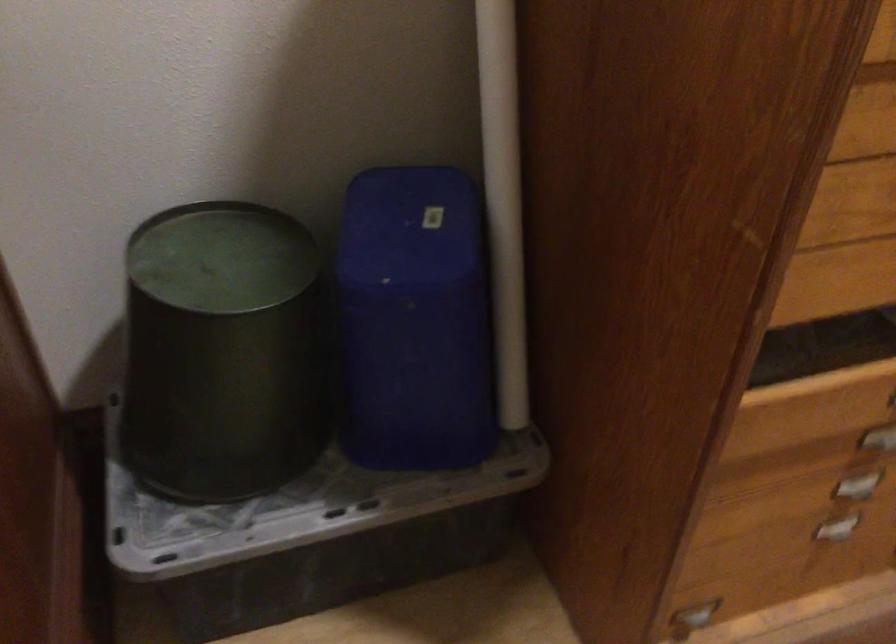
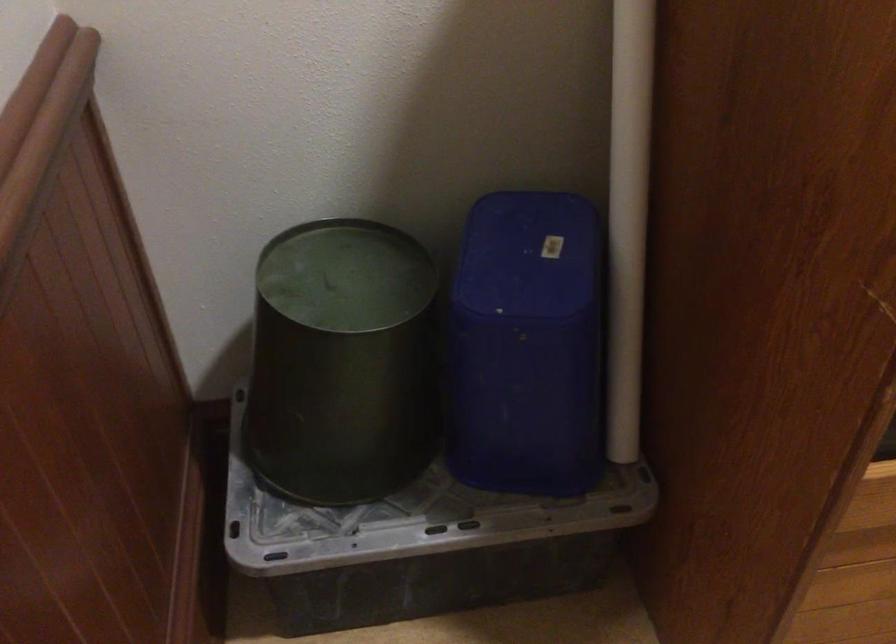
Question: The images are taken continuously from a first-person perspective. In which direction are you moving?

Choices:
 (A) Left
 (B) Right
 (C) Forward
 (D) Backward

Answer: (B)